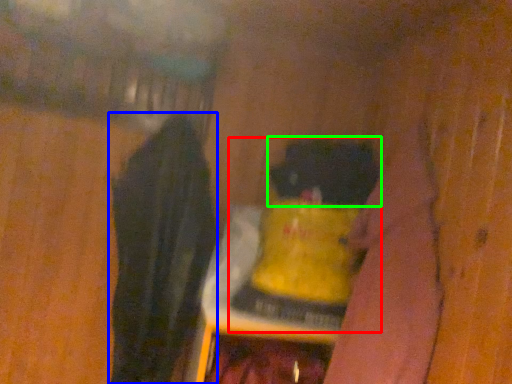
Question: Which object is the closest to the bottle (highlighted by a red box)? Choose among these: clothing (highlighted by a blue box) or animal (highlighted by a green box).

Choices:
 (A) clothing
 (B) animal

Answer: (B)